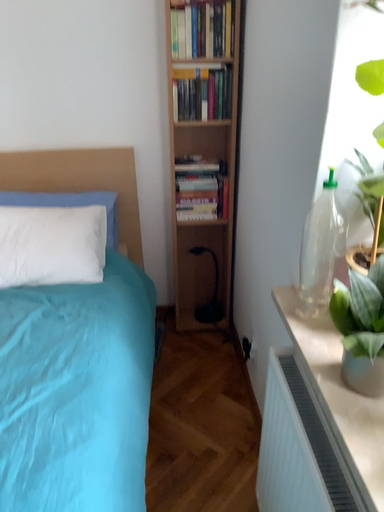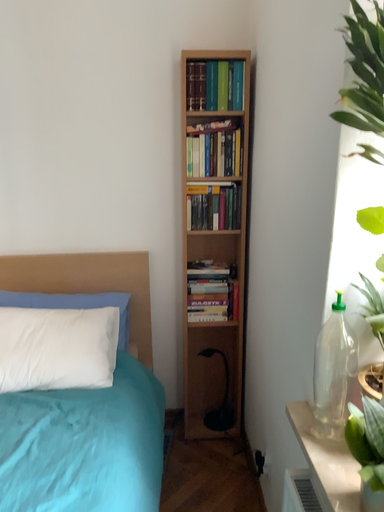
Question: How did the camera likely rotate when shooting the video?

Choices:
 (A) rotated upward
 (B) rotated downward

Answer: (A)